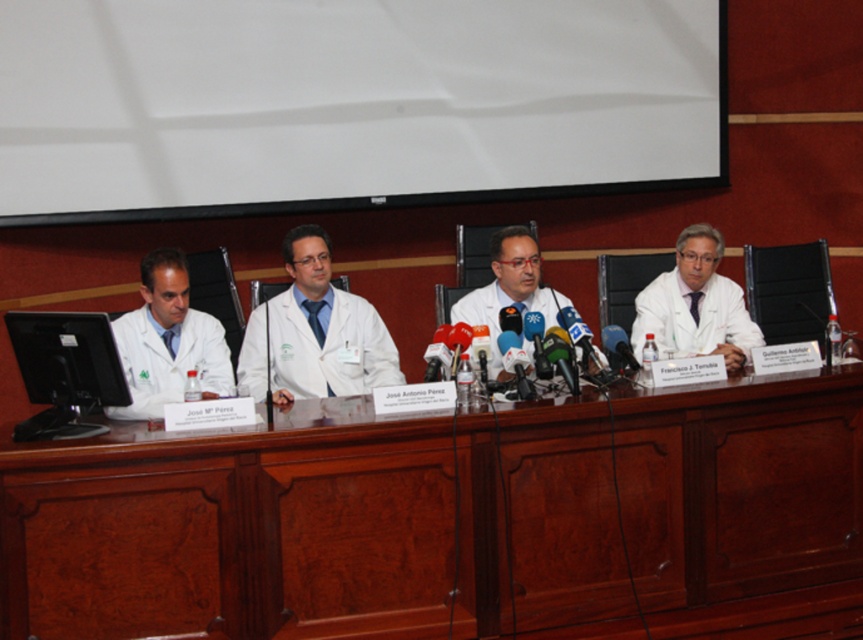
You are organizing an event and need to ensure that the white matte projection screen at upper center and the white lab coat at left are both visible to the audience. Given their sizes, which one will appear bigger to the audience?

The white matte projection screen at upper center will appear bigger to the audience because it has a larger size compared to the white lab coat at left.

You are a photographer positioned at the entrance of the room. You need to capture a photo of the brown wood table at center. What is the exact coordinate where the table is located?

The brown wood table at center is located at coordinate point (316, 525).

You are an event organizer setting up a presentation room. You need to ensure that the white matte projection screen at upper center and the white lab coat at right are visible to all attendees. Given their sizes, which object requires more vertical space to be fully visible?

The white matte projection screen at upper center requires more vertical space to be fully visible since it has a greater height compared to the white lab coat at right.